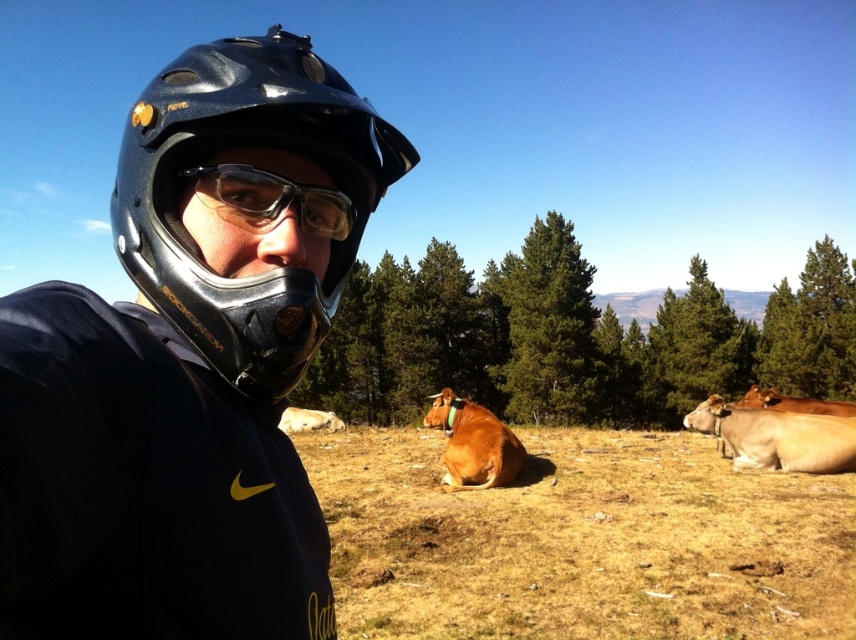
Which is in front, point (343, 93) or point (159, 202)?

Positioned in front is point (159, 202).

Can you confirm if black matte helmet at center is positioned above black matte helmet at left?

No, black matte helmet at center is not above black matte helmet at left.

Measure the distance between point (179,252) and camera.

Point (179,252) and camera are 72.93 centimeters apart from each other.

You are a GUI agent. You are given a task and a screenshot of the screen. Output one action in this format:
    pyautogui.click(x=<x>, y=<y>)
    Task: Click on the black matte helmet at center
    The image size is (856, 640).
    Given the screenshot: What is the action you would take?
    pos(189,362)

Can you confirm if black matte helmet at center is thinner than transparent plastic goggles at center?

Incorrect, black matte helmet at center's width is not less than transparent plastic goggles at center's.

Is point (197, 493) closer to viewer compared to point (302, 228)?

Yes, it is.

In order to click on black matte helmet at center in this screenshot , I will do `click(189, 362)`.

Is brown smooth cow at lower right bigger than brown leather cow at right?

No.

Can you confirm if brown smooth cow at lower right is thinner than brown leather cow at right?

Correct, brown smooth cow at lower right's width is less than brown leather cow at right's.

Is point (756, 465) farther from viewer compared to point (755, 394)?

No, it is in front of (755, 394).

Where is `brown smooth cow at lower right`? brown smooth cow at lower right is located at coordinates (777, 436).